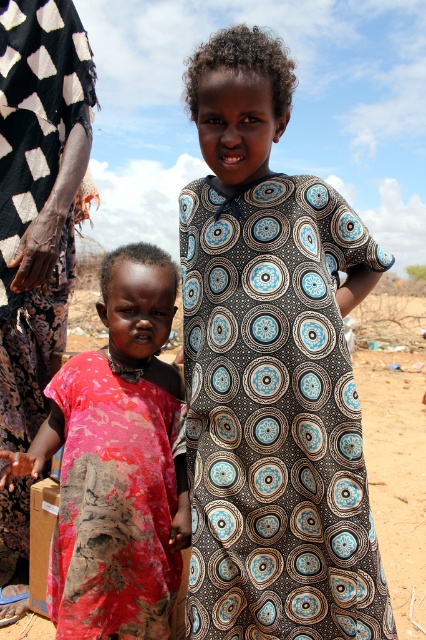
Is black printed dress at center positioned behind rusty fabric dress at center?

No.

Who is positioned more to the left, black printed dress at center or rusty fabric dress at center?

Positioned to the left is rusty fabric dress at center.

What do you see at coordinates (276, 417) in the screenshot? The image size is (426, 640). I see `black printed dress at center` at bounding box center [276, 417].

The height and width of the screenshot is (640, 426). In order to click on black printed dress at center in this screenshot , I will do `click(276, 417)`.

Does point (316, 321) come behind point (17, 81)?

No.

Does black printed dress at center appear under black printed dress at left?

Yes.

You are a GUI agent. You are given a task and a screenshot of the screen. Output one action in this format:
    pyautogui.click(x=<x>, y=<y>)
    Task: Click on the black printed dress at center
    
    Given the screenshot: What is the action you would take?
    pyautogui.click(x=276, y=417)

You are a GUI agent. You are given a task and a screenshot of the screen. Output one action in this format:
    pyautogui.click(x=<x>, y=<y>)
    Task: Click on the black printed dress at center
    The height and width of the screenshot is (640, 426).
    Given the screenshot: What is the action you would take?
    pyautogui.click(x=276, y=417)

Between rusty fabric dress at center and black printed dress at left, which one has more height?

With more height is black printed dress at left.

Is point (65, 483) more distant than point (16, 246)?

No, it is not.

You are a GUI agent. You are given a task and a screenshot of the screen. Output one action in this format:
    pyautogui.click(x=<x>, y=<y>)
    Task: Click on the rusty fabric dress at center
    Image resolution: width=426 pixels, height=640 pixels.
    Given the screenshot: What is the action you would take?
    pyautogui.click(x=118, y=461)